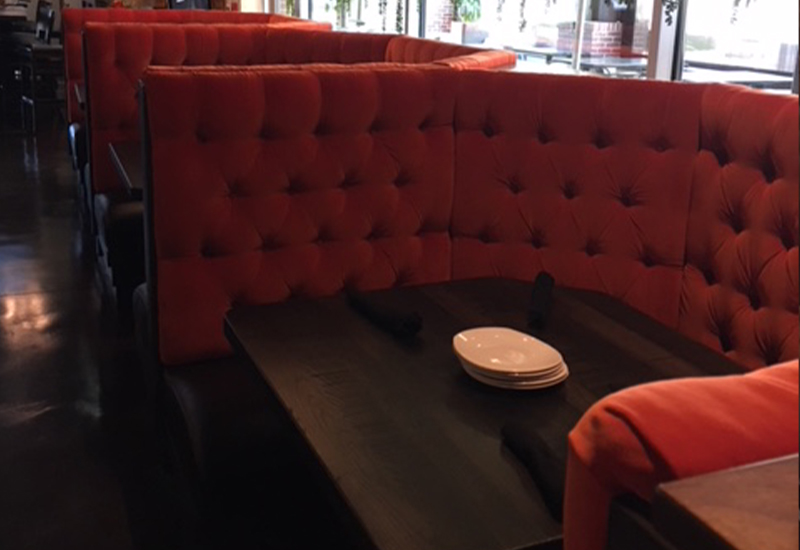
Locate an element on the screen. stack of plates is located at coordinates (500, 360).